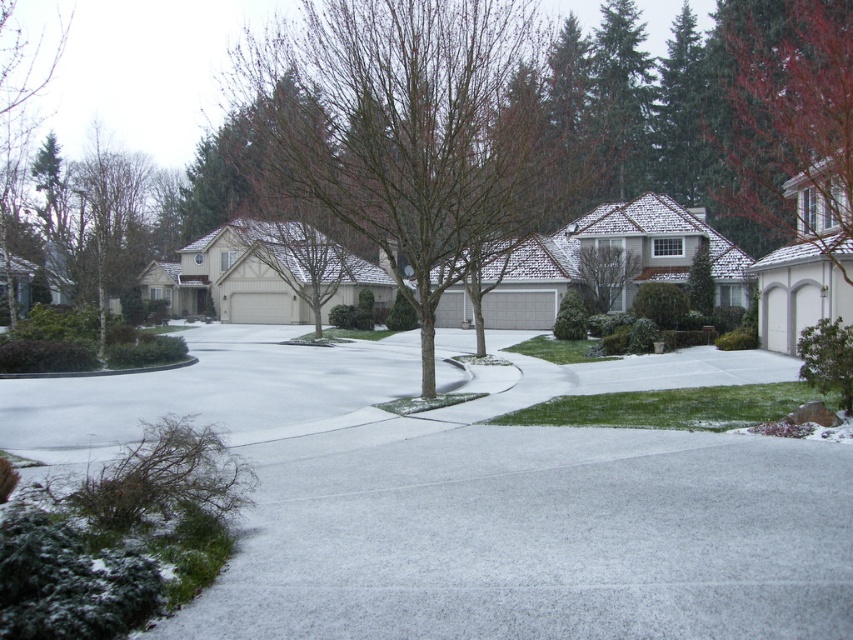
Question: Based on their relative distances, which object is nearer to the white textured pavement at lower center?

Choices:
 (A) red matte tree at upper right
 (B) bare branches at center

Answer: (A)

Question: Which point is farther to the camera?

Choices:
 (A) (776, 218)
 (B) (294, 147)
 (C) (358, 500)

Answer: (A)

Question: Is white textured pavement at lower center smaller than bare branches at center?

Choices:
 (A) no
 (B) yes

Answer: (B)

Question: Can you confirm if bare branches at center is positioned below red matte tree at upper right?

Choices:
 (A) yes
 (B) no

Answer: (B)

Question: Which object is positioned closest to the red matte tree at upper right?

Choices:
 (A) white textured pavement at lower center
 (B) bare branches at center

Answer: (A)

Question: Can you confirm if white textured pavement at lower center is smaller than red matte tree at upper right?

Choices:
 (A) yes
 (B) no

Answer: (A)